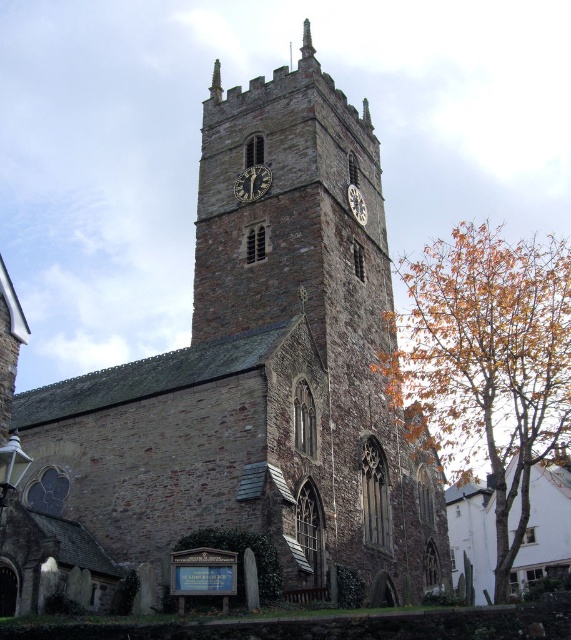
You are a maintenance worker needing to reach both the dark brown wooden clock at center and the metallic clock face at center on the church tower. The ladder you have can extend up to 8 meters. Can you safely reach both objects with the ladder you have?

The distance between the dark brown wooden clock at center and the metallic clock face at center is 9.22 meters, which exceeds the ladder extension limit of 8 meters. Therefore, the ladder cannot safely reach both objects.

You are a maintenance worker inspecting the church tower. You notice two clocks on the tower, the dark brown wooden clock at center and the metallic clock face at center. Which one is narrower in width?

The dark brown wooden clock at center is thinner than the metallic clock face at center, so the dark brown wooden clock at center is narrower in width.